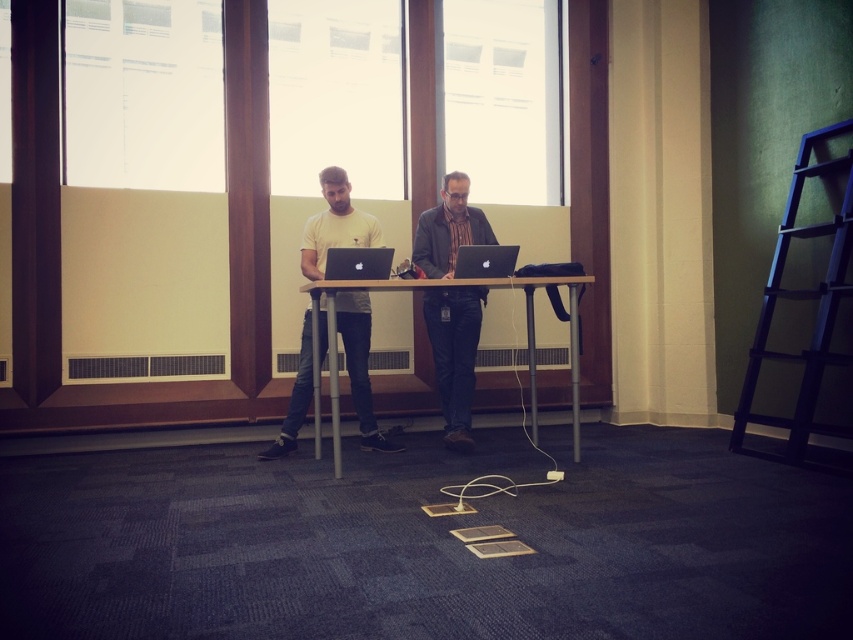
Question: Which point is farther to the camera?

Choices:
 (A) matte black jacket at center
 (B) matte yellow t-shirt at center
 (C) dark blue wooden ladder at right

Answer: (A)

Question: Based on their relative distances, which object is farther from the matte yellow t-shirt at center?

Choices:
 (A) glossy black laptop at center
 (B) metallic silver table at center
 (C) matte black laptop at center

Answer: (A)

Question: Does matte yellow t-shirt at center lie in front of glossy black laptop at center?

Choices:
 (A) yes
 (B) no

Answer: (A)

Question: Estimate the real-world distances between objects in this image. Which object is farther from the glossy black laptop at center?

Choices:
 (A) matte yellow t-shirt at center
 (B) matte black laptop at center
 (C) matte black jacket at center

Answer: (A)

Question: Does matte yellow t-shirt at center appear on the left side of matte black jacket at center?

Choices:
 (A) no
 (B) yes

Answer: (B)

Question: In this image, where is dark blue wooden ladder at right located relative to glossy black laptop at center?

Choices:
 (A) left
 (B) right

Answer: (B)